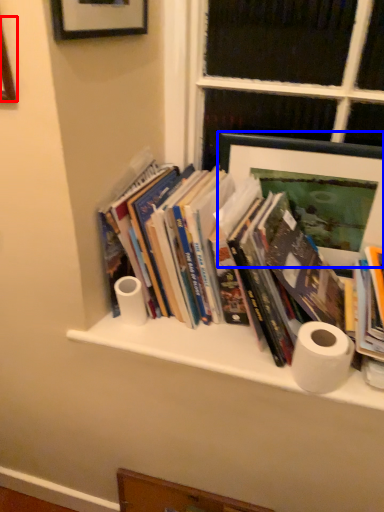
Question: Among these objects, which one is farthest to the camera, picture frame (highlighted by a red box) or picture frame (highlighted by a blue box)?

Choices:
 (A) picture frame
 (B) picture frame

Answer: (B)